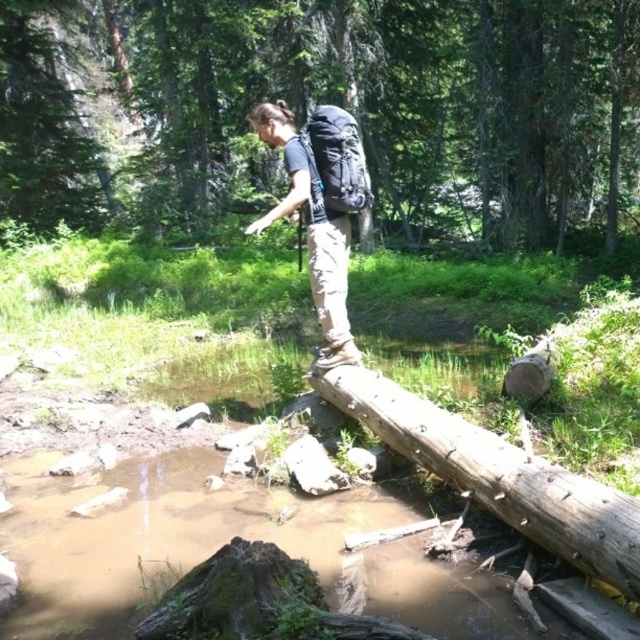
Based on the photo, you are a hiker trying to cross the stream in the forest. You see the brown rough log at center. Where is the log located in the image?

The brown rough log at center is located at the 2D coordinates point (326, 100) in the image.

You are a hiker who needs to cross the stream using the brown rough log at center. Your matte black backpack at center is currently on the ground. Can you reach your backpack from your current position on the log without stepping off it?

The brown rough log at center and matte black backpack at center are 12.38 meters apart. Since the distance is too far to reach from the log, you cannot retrieve the backpack without stepping off.

You are a hiker trying to cross the stream using the brown rough wood log at center. Based on the log location, can you estimate whether it is positioned directly over the stream?

The brown rough wood log at center is located at point coordinates that are not provided in the scene description. However, according to the scene description, the log is described as lying across the muddy water, which implies it is indeed positioned over the stream to serve as a bridge. Therefore, the log is placed directly over the stream for crossing.